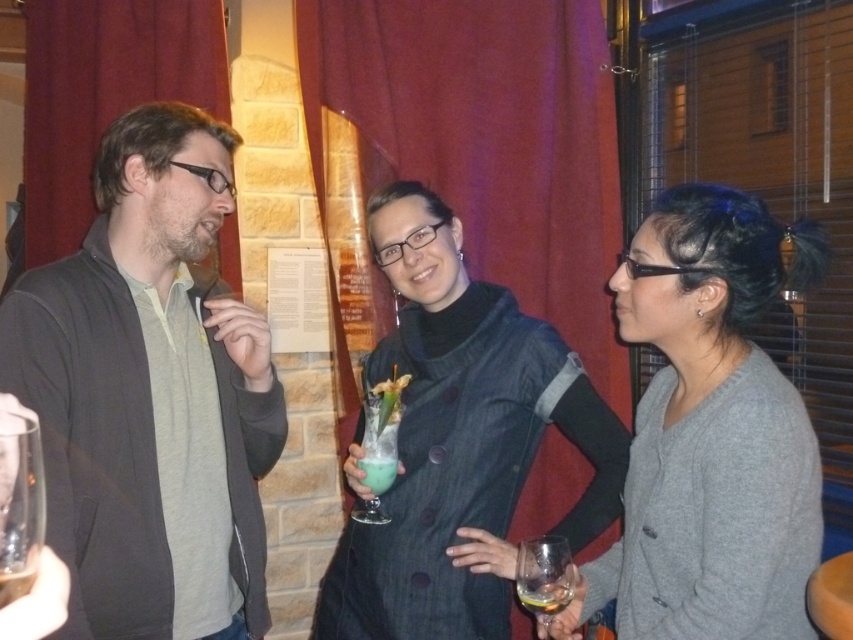
Who is more forward, [15,493] or [561,554]?

Point [15,493] is in front.

Is point (4, 419) farther from camera compared to point (537, 612)?

No, it is not.

You are a GUI agent. You are given a task and a screenshot of the screen. Output one action in this format:
    pyautogui.click(x=<x>, y=<y>)
    Task: Click on the transparent glass at lower left
    The image size is (853, 640).
    Given the screenshot: What is the action you would take?
    pyautogui.click(x=19, y=506)

Which of these two, dark gray sweater at left or denim jacket at center, stands shorter?

Standing shorter between the two is denim jacket at center.

Is point (74, 332) farther from camera compared to point (431, 397)?

No, (74, 332) is closer to viewer.

You are a GUI agent. You are given a task and a screenshot of the screen. Output one action in this format:
    pyautogui.click(x=<x>, y=<y>)
    Task: Click on the dark gray sweater at left
    
    Given the screenshot: What is the action you would take?
    pyautogui.click(x=149, y=394)

Who is taller, denim jacket at center or clear glass at lower left?

denim jacket at center is taller.

Which is more to the right, denim jacket at center or clear glass at lower left?

Positioned to the right is denim jacket at center.

Is point (498, 396) positioned after point (10, 561)?

Yes, point (498, 396) is farther from viewer.

I want to click on denim jacket at center, so click(x=460, y=440).